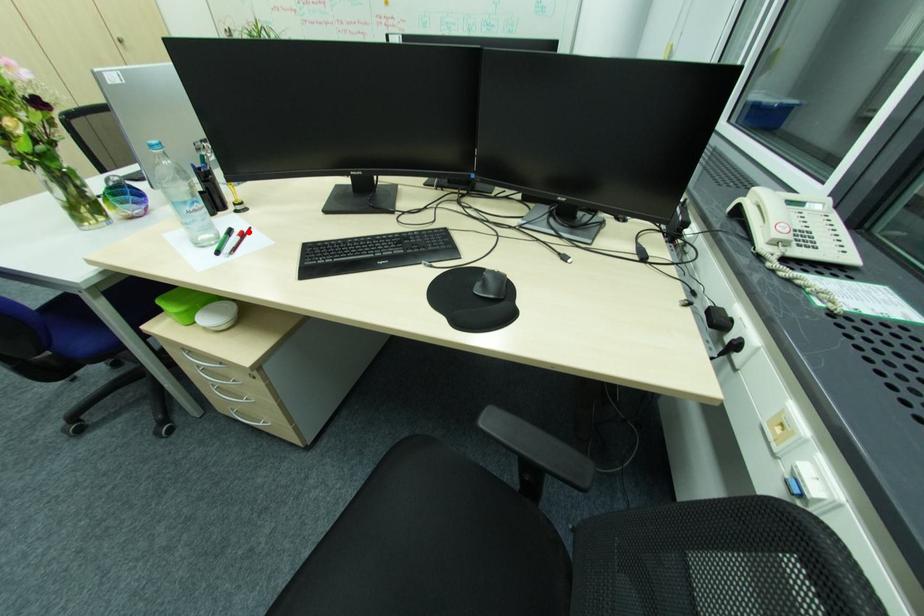
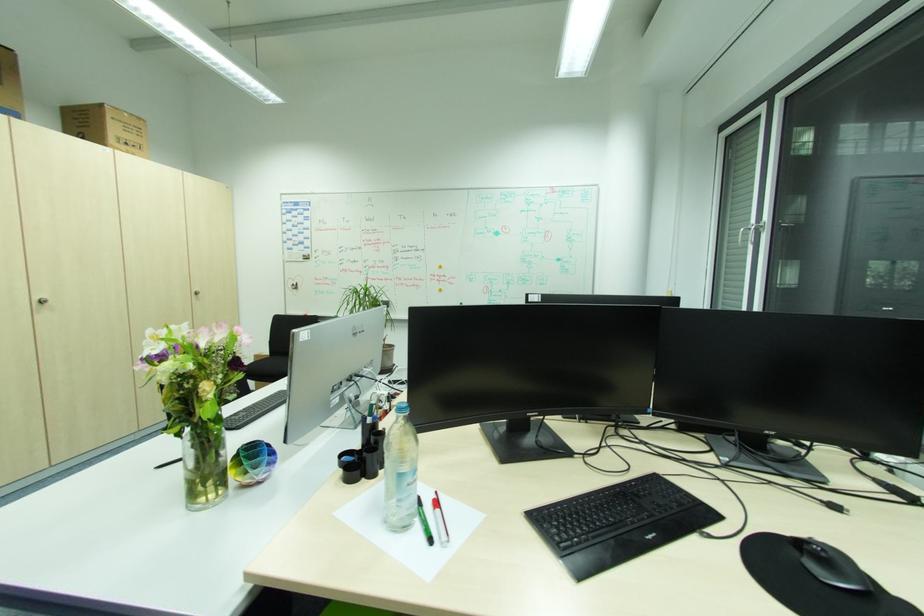
In the second image, find the point that corresponds to the highlighted location in the first image.

(440, 500)